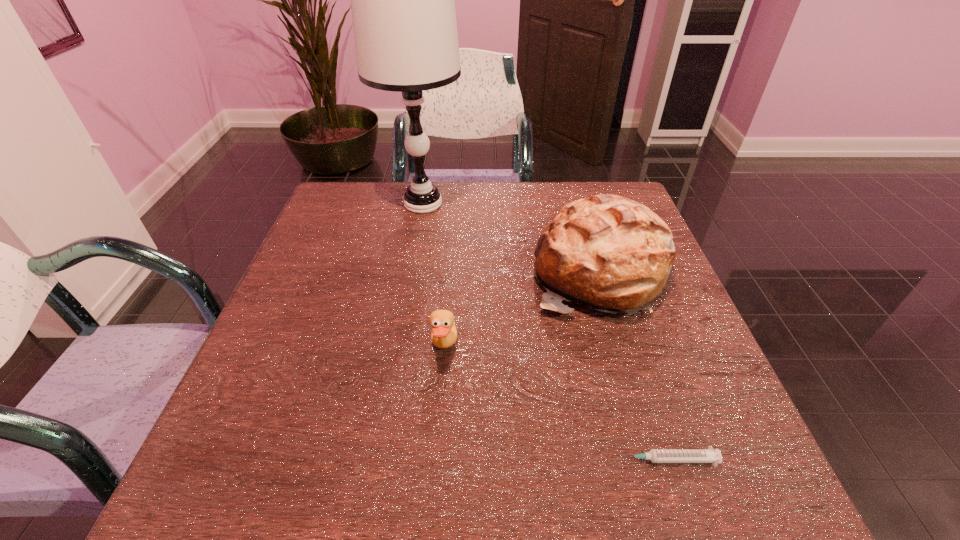
Find the location of a particular element. Image resolution: width=960 pixels, height=540 pixels. vacant region located 0.070m on the beak of the duck is located at coordinates (492, 348).

The width and height of the screenshot is (960, 540). Identify the location of vacant space located at the needle end of the syringe. (573, 460).

Where is `vacant area situated at the needle end of the syringe`? Image resolution: width=960 pixels, height=540 pixels. vacant area situated at the needle end of the syringe is located at coordinates (536, 460).

Image resolution: width=960 pixels, height=540 pixels. What are the coordinates of `vacant space located at the needle end of the syringe` in the screenshot? It's located at (487, 460).

Where is `object at the far edge`? Image resolution: width=960 pixels, height=540 pixels. object at the far edge is located at coordinates (403, 0).

What are the coordinates of `object that is at the near edge` in the screenshot? It's located at (709, 455).

You are a GUI agent. You are given a task and a screenshot of the screen. Output one action in this format:
    pyautogui.click(x=<x>, y=<y>)
    Task: Click on the object that is positioned at the left edge
    This screenshot has height=540, width=960.
    Given the screenshot: What is the action you would take?
    pyautogui.click(x=403, y=0)

The height and width of the screenshot is (540, 960). In order to click on bread at the right edge in this screenshot , I will do `click(611, 253)`.

Find the location of `syringe that is at the right edge`. syringe that is at the right edge is located at coordinates point(709,455).

Where is `object at the far left corner`? object at the far left corner is located at coordinates (403, 0).